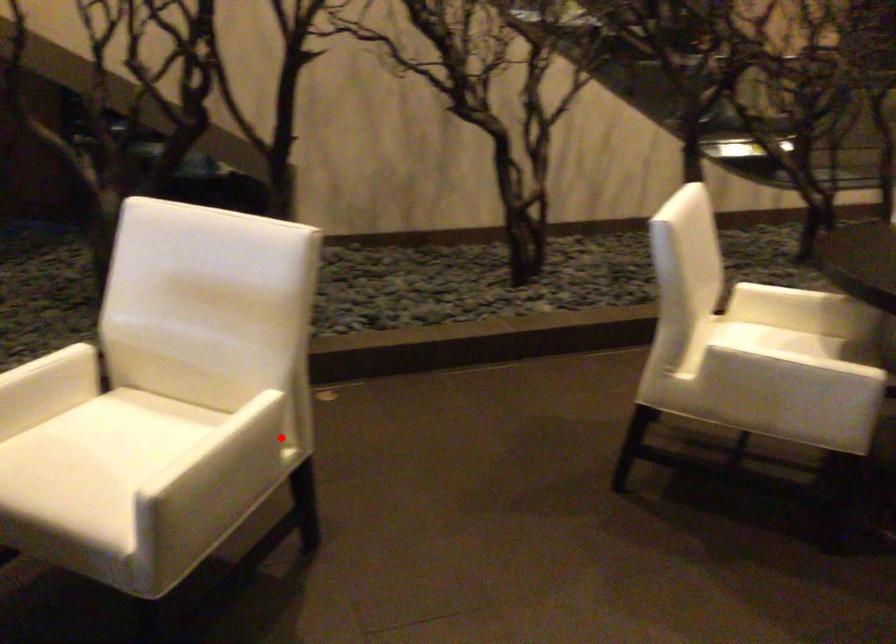
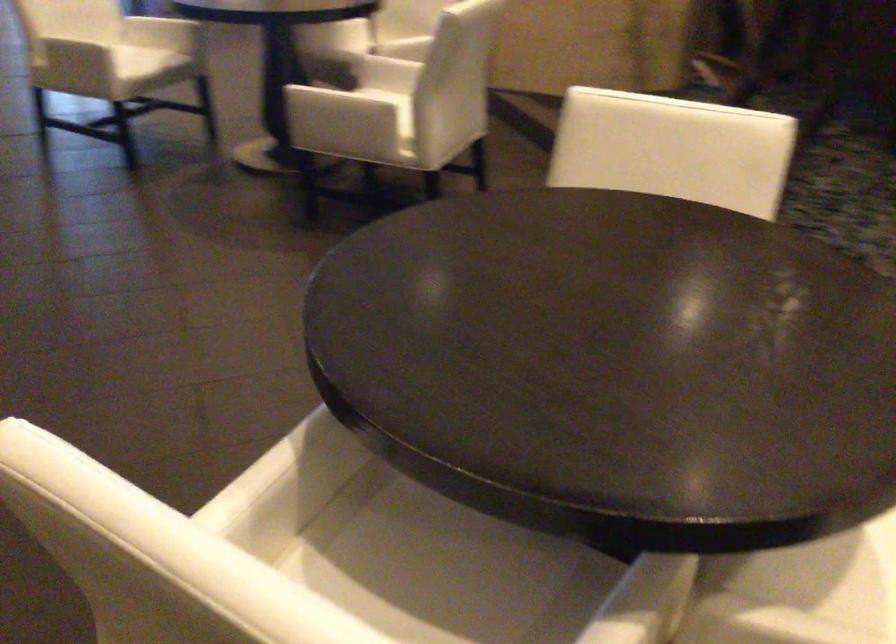
Question: A red point is marked in image1. In image2, is the corresponding 3D point closer to the camera or farther? Reply with the corresponding letter.

Choices:
 (A) The corresponding 3D point is closer.
 (B) The corresponding 3D point is farther.

Answer: (B)